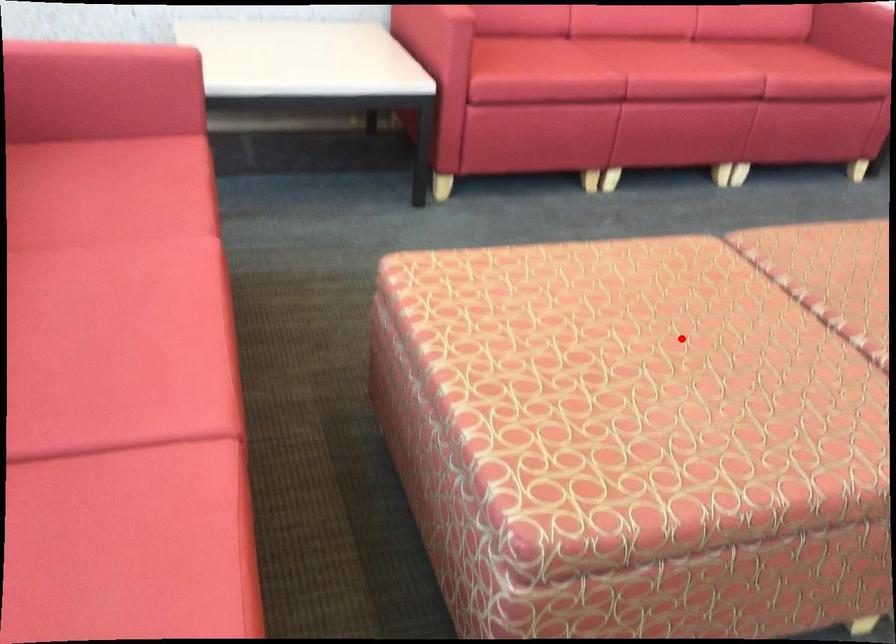
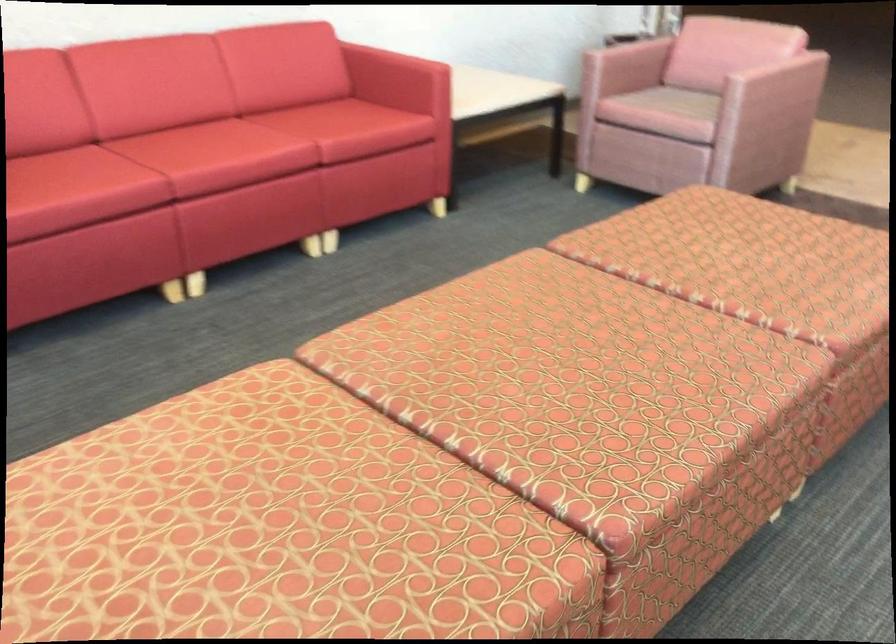
Locate, in the second image, the point that corresponds to the highlighted location in the first image.

(250, 522)